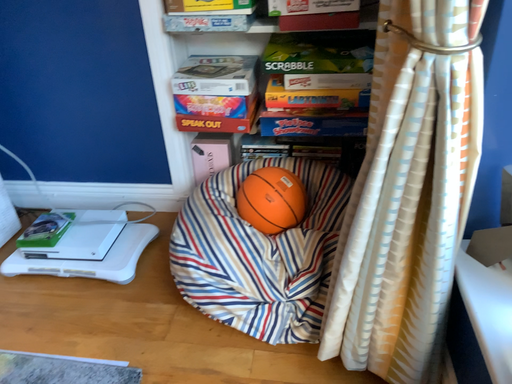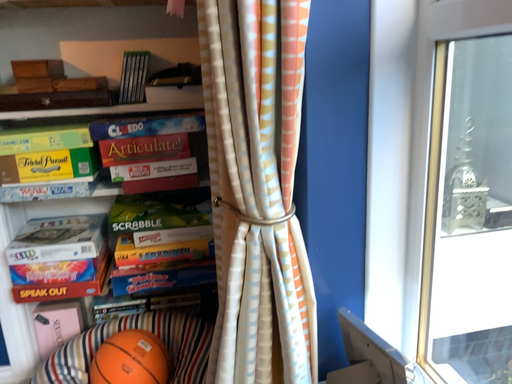
Question: How did the camera likely rotate when shooting the video?

Choices:
 (A) rotated upward
 (B) rotated downward

Answer: (A)